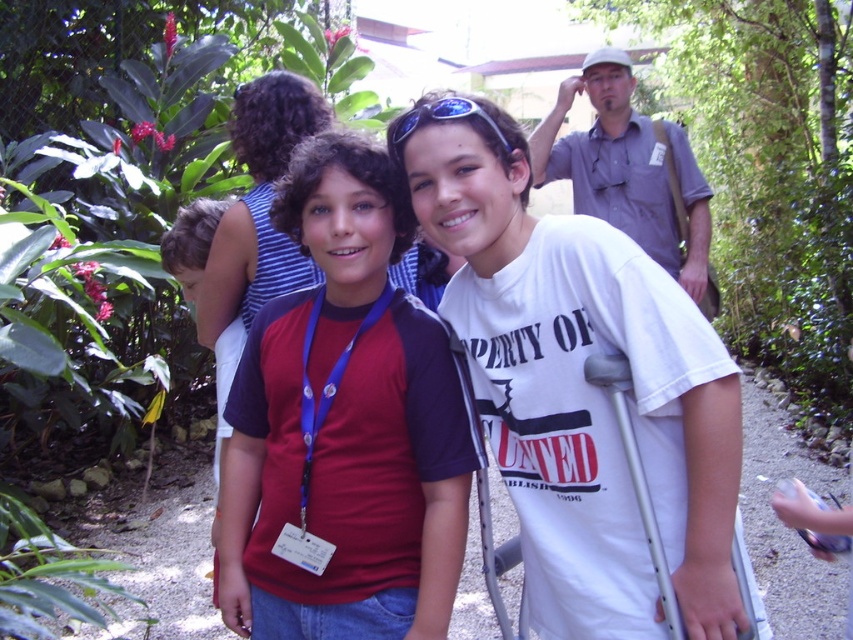
Does gray shirt at upper center have a lesser height compared to blue striped shirt at center?

No.

Who is more distant from viewer, (585, 179) or (218, 310)?

Point (585, 179)

Find the location of `gray shirt at upper center`. gray shirt at upper center is located at coordinates (630, 170).

Find the location of `gray shirt at upper center`. gray shirt at upper center is located at coordinates (630, 170).

Does gray shirt at upper center appear over blue reflective sunglasses at center?

Indeed, gray shirt at upper center is positioned over blue reflective sunglasses at center.

Is point (627, 132) less distant than point (405, 131)?

No.

Is point (575, 195) positioned in front of point (450, 97)?

No, it is not.

Where is `gray shirt at upper center`? gray shirt at upper center is located at coordinates (630, 170).

Who is positioned more to the left, blue striped shirt at center or blue reflective sunglasses at center?

Positioned to the left is blue striped shirt at center.

Does blue striped shirt at center lie behind blue reflective sunglasses at center?

Yes, it is behind blue reflective sunglasses at center.

What do you see at coordinates (258, 208) in the screenshot? I see `blue striped shirt at center` at bounding box center [258, 208].

You are a GUI agent. You are given a task and a screenshot of the screen. Output one action in this format:
    pyautogui.click(x=<x>, y=<y>)
    Task: Click on the blue striped shirt at center
    
    Given the screenshot: What is the action you would take?
    pyautogui.click(x=258, y=208)